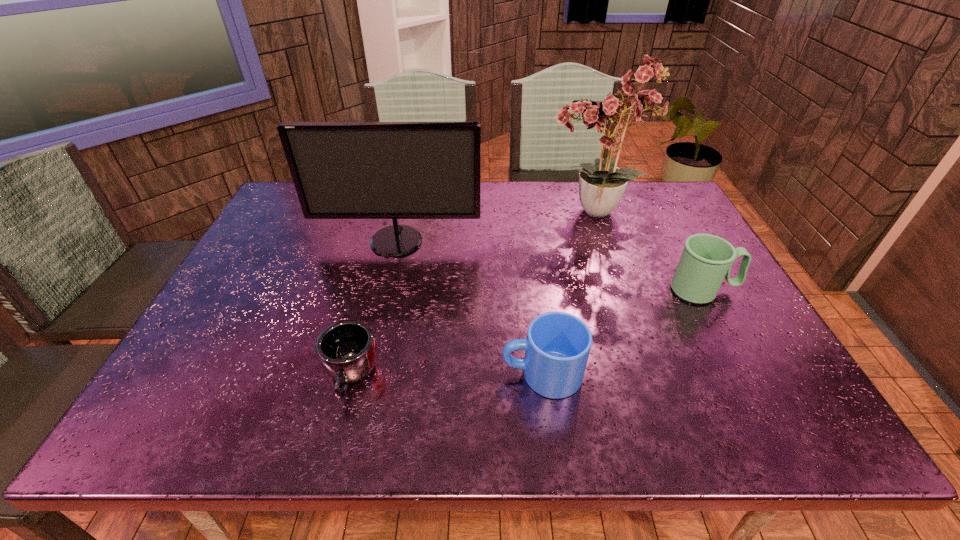
You are a GUI agent. You are given a task and a screenshot of the screen. Output one action in this format:
    pyautogui.click(x=<x>, y=<y>)
    Task: Click on the tallest object
    The width and height of the screenshot is (960, 540).
    Given the screenshot: What is the action you would take?
    pyautogui.click(x=601, y=185)

In order to click on computer monitor in this screenshot , I will do `click(341, 170)`.

Identify the location of the farthest mug. This screenshot has width=960, height=540. (706, 260).

Where is `the rightmost mug`? the rightmost mug is located at coordinates (706, 260).

The height and width of the screenshot is (540, 960). I want to click on the second mug from left to right, so click(557, 346).

I want to click on the shortest mug, so [346, 350].

I want to click on the shortest object, so click(346, 350).

Identify the location of free space located on the front-facing side of the tallest object. (468, 213).

What are the coordinates of `free space located on the front-facing side of the tallest object` in the screenshot? It's located at (477, 213).

The height and width of the screenshot is (540, 960). I want to click on vacant region located 0.240m on the front-facing side of the tallest object, so (x=465, y=213).